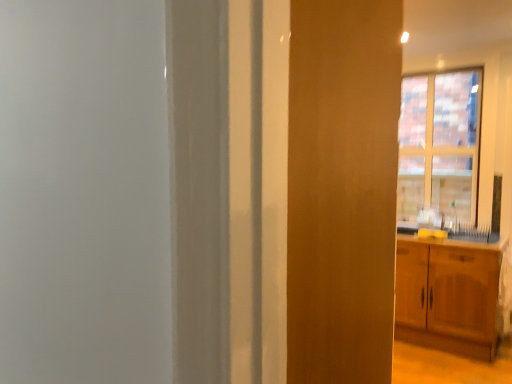
Question: Could you tell me if brick textured window at upper right is turned towards wooden cabinet at right?

Choices:
 (A) yes
 (B) no

Answer: (B)

Question: Does brick textured window at upper right touch wooden cabinet at right?

Choices:
 (A) yes
 (B) no

Answer: (B)

Question: Does brick textured window at upper right appear on the right side of wooden cabinet at right?

Choices:
 (A) no
 (B) yes

Answer: (B)

Question: Considering the relative sizes of brick textured window at upper right and wooden cabinet at right in the image provided, is brick textured window at upper right thinner than wooden cabinet at right?

Choices:
 (A) no
 (B) yes

Answer: (B)

Question: Is there a large distance between brick textured window at upper right and wooden cabinet at right?

Choices:
 (A) yes
 (B) no

Answer: (B)

Question: Considering the relative sizes of brick textured window at upper right and wooden cabinet at right in the image provided, is brick textured window at upper right smaller than wooden cabinet at right?

Choices:
 (A) yes
 (B) no

Answer: (A)

Question: From a real-world perspective, does wooden cabinet at right stand above brick textured window at upper right?

Choices:
 (A) no
 (B) yes

Answer: (A)

Question: Could you tell me if wooden cabinet at right is turned towards brick textured window at upper right?

Choices:
 (A) no
 (B) yes

Answer: (A)

Question: Is wooden cabinet at right in front of brick textured window at upper right?

Choices:
 (A) yes
 (B) no

Answer: (A)

Question: From the image's perspective, is wooden cabinet at right above brick textured window at upper right?

Choices:
 (A) no
 (B) yes

Answer: (A)

Question: Can you confirm if wooden cabinet at right is positioned to the left of brick textured window at upper right?

Choices:
 (A) yes
 (B) no

Answer: (A)

Question: Would you say wooden cabinet at right is a long distance from brick textured window at upper right?

Choices:
 (A) no
 (B) yes

Answer: (A)

Question: In terms of height, does wooden cabinet at right look taller or shorter compared to brick textured window at upper right?

Choices:
 (A) tall
 (B) short

Answer: (B)